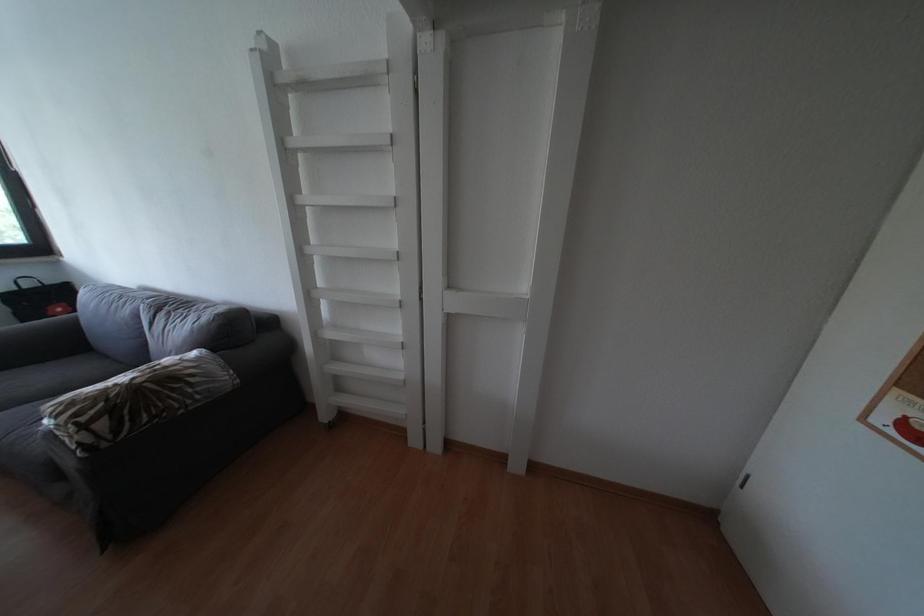
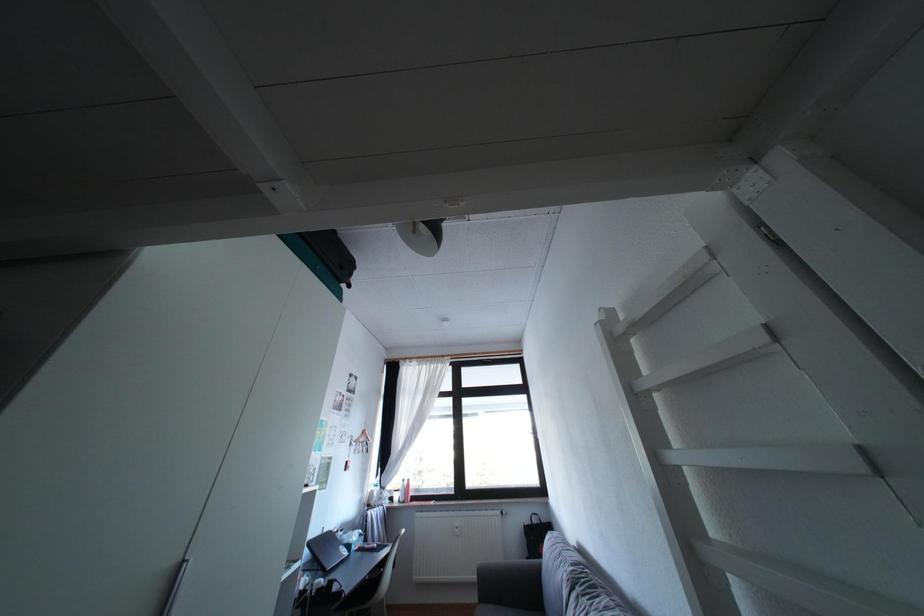
The first image is from the beginning of the video and the second image is from the end. How did the camera likely rotate when shooting the video?

The camera rotated toward left-up.